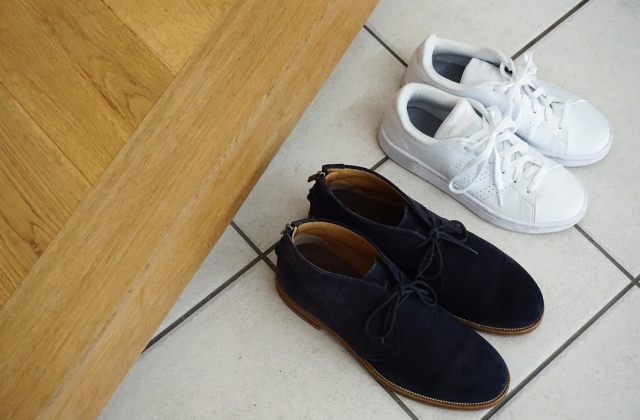
What are the coordinates of `white tiles` in the screenshot? It's located at (219, 368), (217, 259), (317, 147), (456, 20), (593, 70), (550, 265), (586, 401).